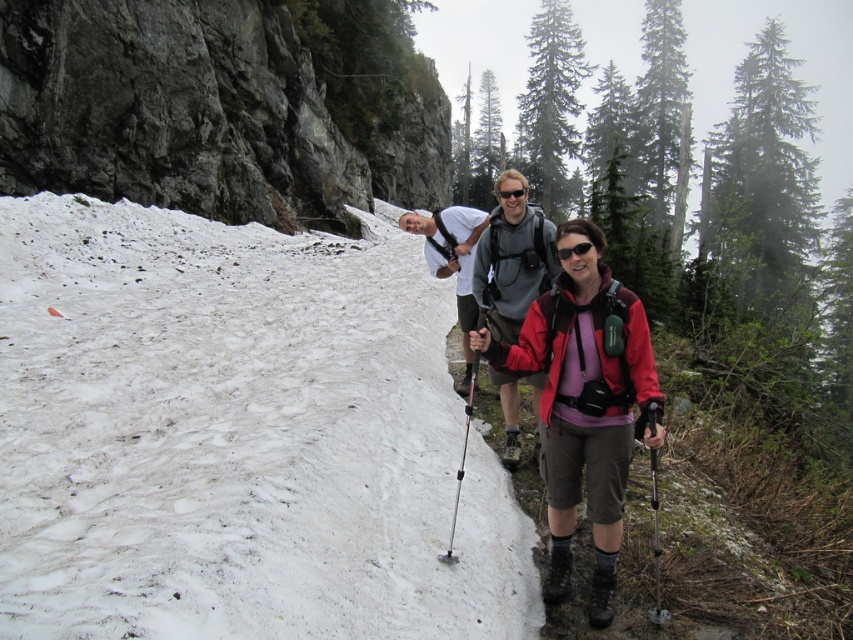
Looking at this image, you are a hiker who wants to know if the red fabric jacket at center is higher than the black rubber ski pole at center in the image. Based on the scene description, can you determine this?

The red fabric jacket at center is above the black rubber ski pole at center, so yes, it is higher.

You are standing at the point marked as point [454,257] and want to walk to the nearest hiker. The nearest hiker is 5 meters away from you. Can you reach the nearest hiker without walking more than 7.95 meters?

Yes, because the distance between you and the viewer is 7.95 meters, which is greater than the 5 meters needed to reach the nearest hiker.

You are a hiker carrying a backpack with a 16 inch wide tent pole. You need to place the tent pole between the red fabric jacket at center and the gray fleece jacket at center. Can you fit the tent pole between them?

The distance between the red fabric jacket at center and the gray fleece jacket at center is 17.39 inches. Since the tent pole is 16 inches wide, it can fit between them with some space to spare.